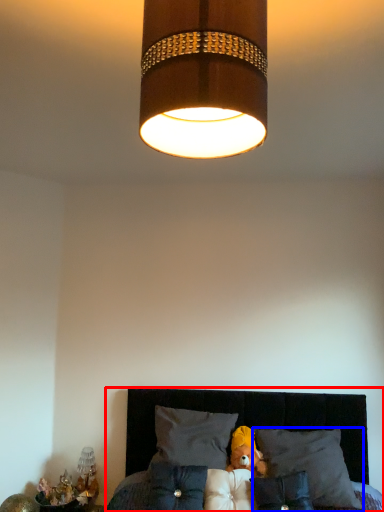
Question: Which object appears farthest to the camera in this image, furniture (highlighted by a red box) or pillow (highlighted by a blue box)?

Choices:
 (A) furniture
 (B) pillow

Answer: (B)